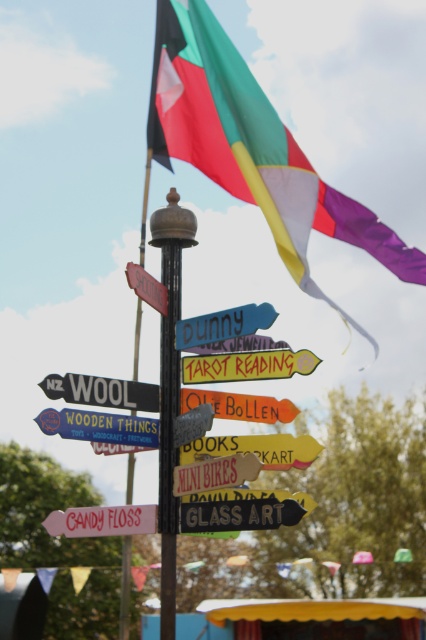
Question: Can you confirm if matte glass signpost at center is bigger than matte red signpost at upper center?

Choices:
 (A) no
 (B) yes

Answer: (B)

Question: Which object is closer to the camera taking this photo?

Choices:
 (A) wooden sign at center
 (B) orange matte sign at center
 (C) yellow matte signpost at center
 (D) black wooden signpost at upper center

Answer: (C)

Question: Which object is the farthest from the wooden signpost at center?

Choices:
 (A) black metal pole at center
 (B) matte glass signpost at center
 (C) blue painted wooden signpost at center

Answer: (B)

Question: Does black metal pole at center lie behind black wooden signpost at upper center?

Choices:
 (A) no
 (B) yes

Answer: (B)

Question: Does matte glass signpost at center appear on the left side of pink matte candy floss at lower left?

Choices:
 (A) yes
 (B) no

Answer: (B)

Question: Among these points, which one is farthest from the camera?

Choices:
 (A) (75, 413)
 (B) (144, 280)

Answer: (B)